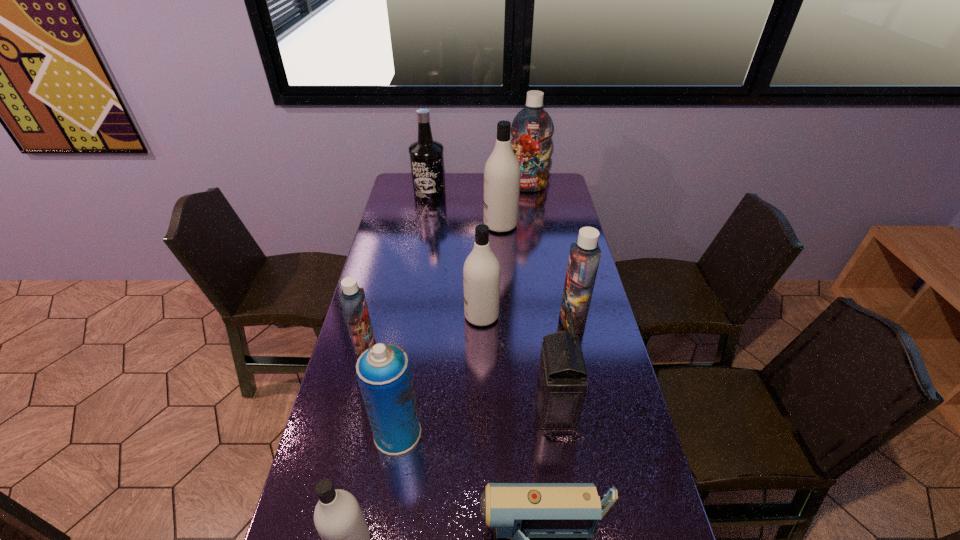
Where is `free location located on the front-facing side of the second farthest white shampoo`? This screenshot has width=960, height=540. free location located on the front-facing side of the second farthest white shampoo is located at coordinates (370, 316).

Image resolution: width=960 pixels, height=540 pixels. What are the coordinates of `free location located on the front-facing side of the second farthest white shampoo` in the screenshot? It's located at tap(361, 316).

Where is `free space located on the front-facing side of the gray lantern`? Image resolution: width=960 pixels, height=540 pixels. free space located on the front-facing side of the gray lantern is located at coordinates (498, 408).

Image resolution: width=960 pixels, height=540 pixels. Identify the location of vacant space situated 0.130m on the front-facing side of the gray lantern. (488, 408).

The width and height of the screenshot is (960, 540). What are the coordinates of `vacant space positioned on the front-facing side of the gray lantern` in the screenshot? It's located at (484, 408).

Where is `vacant area located on the front of the aerosol can`? This screenshot has height=540, width=960. vacant area located on the front of the aerosol can is located at coordinates (382, 534).

Where is `vacant area situated on the front label of the leftmost shampoo`? The width and height of the screenshot is (960, 540). vacant area situated on the front label of the leftmost shampoo is located at coordinates (439, 346).

Locate an element on the screen. shampoo that is at the far edge is located at coordinates (532, 128).

Identify the location of liquor that is at the far edge. Image resolution: width=960 pixels, height=540 pixels. (426, 155).

Find the location of a particular element. Image resolution: width=960 pixels, height=540 pixels. liquor that is at the left edge is located at coordinates pos(426,155).